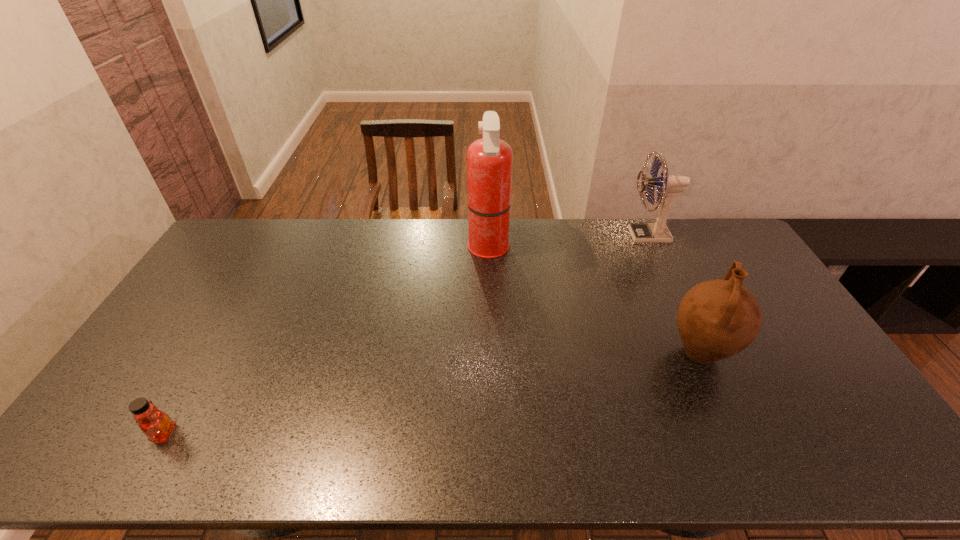
In the image, there is a desktop. At what (x,y) coordinates should I click in order to perform the action: click on vacant area at the near left corner. Please return your answer as a coordinate pair (x, y). Image resolution: width=960 pixels, height=540 pixels. Looking at the image, I should click on (104, 453).

Locate an element on the screen. The image size is (960, 540). free region at the far right corner is located at coordinates (716, 246).

Where is `blank region between the fan and the fire extinguisher`? The width and height of the screenshot is (960, 540). blank region between the fan and the fire extinguisher is located at coordinates (568, 242).

You are a GUI agent. You are given a task and a screenshot of the screen. Output one action in this format:
    pyautogui.click(x=<x>, y=<y>)
    Task: Click on the free spot between the tallest object and the leftmost object
    
    Given the screenshot: What is the action you would take?
    pyautogui.click(x=326, y=341)

In order to click on free space between the fire extinguisher and the fan in this screenshot , I will do `click(568, 242)`.

Locate an element on the screen. empty space that is in between the fan and the shortest object is located at coordinates (406, 334).

Locate an element on the screen. The width and height of the screenshot is (960, 540). vacant space that's between the pitcher and the fan is located at coordinates (674, 294).

Locate an element on the screen. The image size is (960, 540). empty location between the pitcher and the fan is located at coordinates (674, 294).

Where is `vacant area that lies between the leftmost object and the fan`? The image size is (960, 540). vacant area that lies between the leftmost object and the fan is located at coordinates (406, 334).

I want to click on free spot between the honey and the tallest object, so click(326, 341).